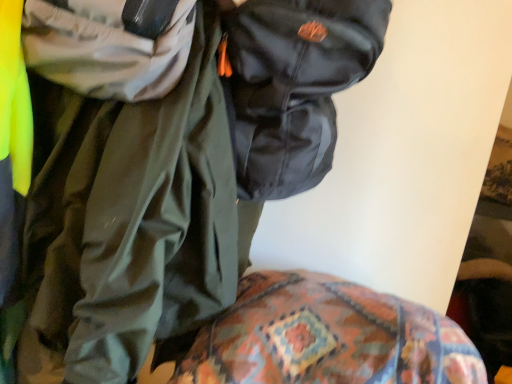
Question: Is shiny black jacket at upper center further to the viewer compared to glossy black backpack at upper center?

Choices:
 (A) no
 (B) yes

Answer: (A)

Question: Does shiny black jacket at upper center turn towards glossy black backpack at upper center?

Choices:
 (A) no
 (B) yes

Answer: (A)

Question: Can we say shiny black jacket at upper center lies outside glossy black backpack at upper center?

Choices:
 (A) no
 (B) yes

Answer: (B)

Question: From a real-world perspective, is shiny black jacket at upper center located higher than glossy black backpack at upper center?

Choices:
 (A) no
 (B) yes

Answer: (A)

Question: Is shiny black jacket at upper center bigger than glossy black backpack at upper center?

Choices:
 (A) yes
 (B) no

Answer: (A)

Question: Considering the relative sizes of shiny black jacket at upper center and glossy black backpack at upper center in the image provided, is shiny black jacket at upper center wider than glossy black backpack at upper center?

Choices:
 (A) yes
 (B) no

Answer: (A)

Question: Would you say glossy black backpack at upper center is a long distance from patterned fabric at lower center?

Choices:
 (A) no
 (B) yes

Answer: (A)

Question: From the image's perspective, is glossy black backpack at upper center above patterned fabric at lower center?

Choices:
 (A) no
 (B) yes

Answer: (B)

Question: Is patterned fabric at lower center surrounded by glossy black backpack at upper center?

Choices:
 (A) no
 (B) yes

Answer: (A)

Question: Is glossy black backpack at upper center oriented towards patterned fabric at lower center?

Choices:
 (A) no
 (B) yes

Answer: (A)

Question: Is glossy black backpack at upper center positioned before patterned fabric at lower center?

Choices:
 (A) no
 (B) yes

Answer: (A)

Question: Does glossy black backpack at upper center have a smaller size compared to patterned fabric at lower center?

Choices:
 (A) yes
 (B) no

Answer: (A)

Question: Would you say shiny black jacket at upper center is outside patterned fabric at lower center?

Choices:
 (A) no
 (B) yes

Answer: (B)